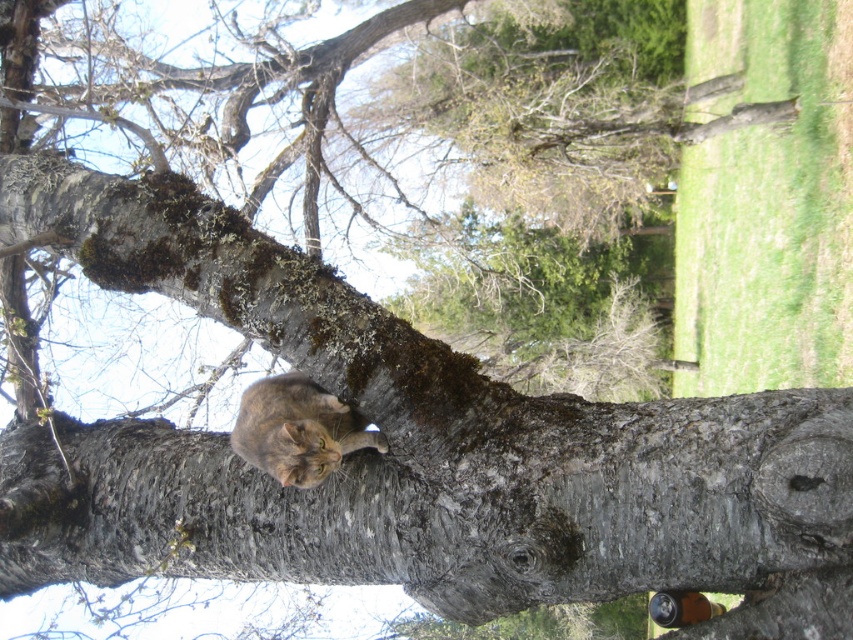
Question: Which point is closer to the camera?

Choices:
 (A) tabby fur cat at upper center
 (B) smooth gray bark at center

Answer: (B)

Question: Is the position of smooth gray bark at center more distant than that of tabby fur cat at upper center?

Choices:
 (A) no
 (B) yes

Answer: (A)

Question: Does smooth gray bark at center appear over tabby fur cat at upper center?

Choices:
 (A) no
 (B) yes

Answer: (A)

Question: Can you confirm if smooth gray bark at center is thinner than tabby fur cat at upper center?

Choices:
 (A) no
 (B) yes

Answer: (A)

Question: Which of the following is the farthest from the observer?

Choices:
 (A) (505, 438)
 (B) (299, 387)

Answer: (B)